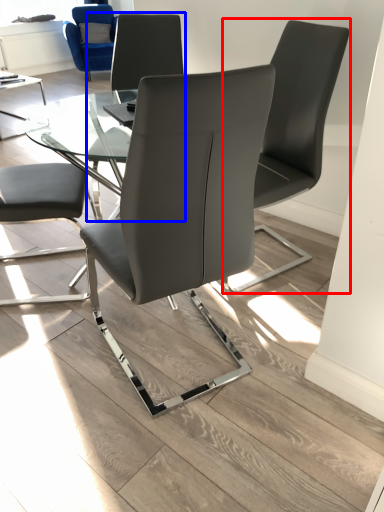
Question: Among these objects, which one is nearest to the camera, chair (highlighted by a red box) or chair (highlighted by a blue box)?

Choices:
 (A) chair
 (B) chair

Answer: (A)